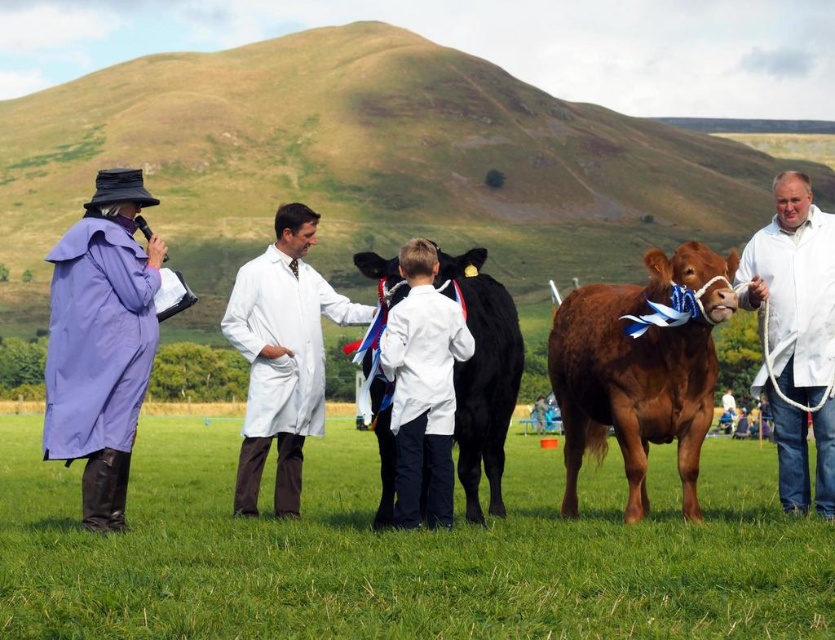
Question: Which object appears closest to the camera in this image?

Choices:
 (A) purple fabric coat at left
 (B) black glossy cow at center
 (C) brown glossy cow at center

Answer: (A)

Question: Which object is closer to the camera taking this photo?

Choices:
 (A) purple fabric coat at left
 (B) brown glossy cow at center
 (C) white matte coat at center

Answer: (A)

Question: Does brown glossy cow at center appear under purple fabric coat at left?

Choices:
 (A) no
 (B) yes

Answer: (B)

Question: Does purple fabric coat at left have a larger size compared to white lab coat at center?

Choices:
 (A) yes
 (B) no

Answer: (A)

Question: Based on their relative distances, which object is nearer to the brown glossy cow at center?

Choices:
 (A) black glossy cow at center
 (B) white matte coat at center
 (C) purple fabric coat at left

Answer: (B)

Question: Considering the relative positions of brown glossy cow at center and white matte coat at center in the image provided, where is brown glossy cow at center located with respect to white matte coat at center?

Choices:
 (A) above
 (B) below

Answer: (A)